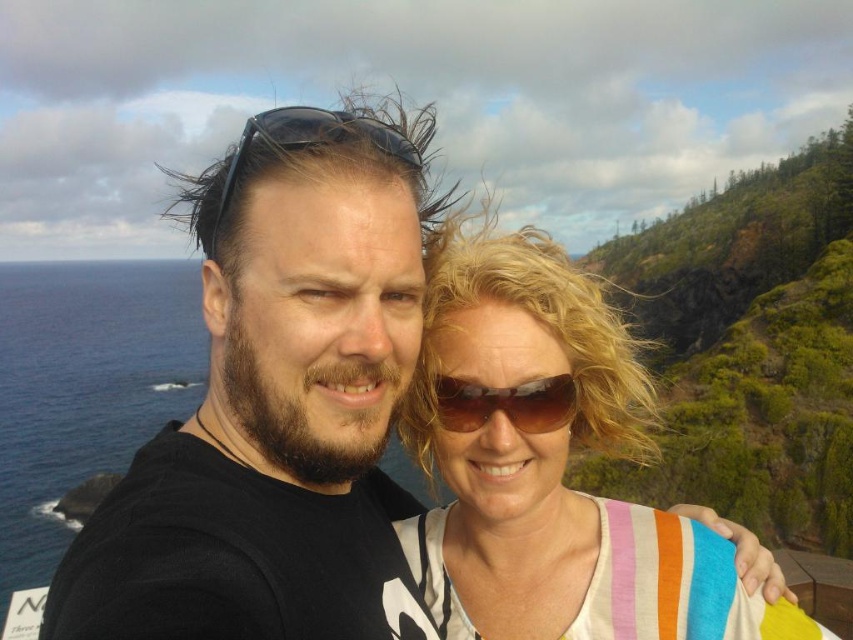
Question: Can you confirm if black matte sunglasses at upper center is positioned below sunglasses at center?

Choices:
 (A) yes
 (B) no

Answer: (B)

Question: Does white striped shirt at center appear on the right side of black matte sunglasses at upper center?

Choices:
 (A) yes
 (B) no

Answer: (A)

Question: Does white striped shirt at center have a larger size compared to sunglasses at center?

Choices:
 (A) no
 (B) yes

Answer: (B)

Question: Which of the following is the closest to the observer?

Choices:
 (A) (248, 124)
 (B) (503, 412)
 (C) (543, 598)

Answer: (A)

Question: Considering the real-world distances, which object is farthest from the sunglasses at center?

Choices:
 (A) white striped shirt at center
 (B) black matte sunglasses at upper center

Answer: (B)

Question: Which of the following is the closest to the observer?

Choices:
 (A) white striped shirt at center
 (B) sunglasses at center
 (C) black matte sunglasses at upper center

Answer: (C)